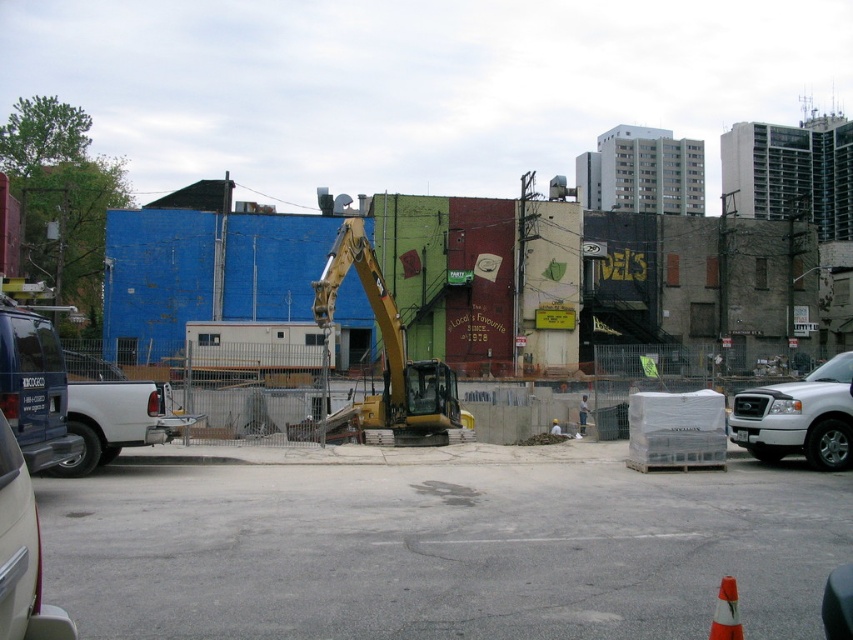
You are a delivery driver who needs to park your vehicle near the orange reflective cone at lower right without blocking the white matte truck at left. Based on the scene, is this possible?

The white matte truck at left is positioned on the left side of the orange reflective cone at lower right, so you can park your vehicle near the orange reflective cone at lower right without blocking the white matte truck at left by positioning it to the right side of the cone.

You are standing at the center of the construction site and want to move towards the white matte truck at right. Which direction should you head?

Since the white matte truck at right is located at coordinates 0.653 on the x and 0.938 on the y axis, you should head northeast to reach it.

You are a delivery driver who needs to park your vehicle in the construction site. You see the white matte truck at right and the orange reflective cone at lower right. Which one is larger in size?

The white matte truck at right is bigger than the orange reflective cone at lower right, so the white matte truck at right is larger in size.